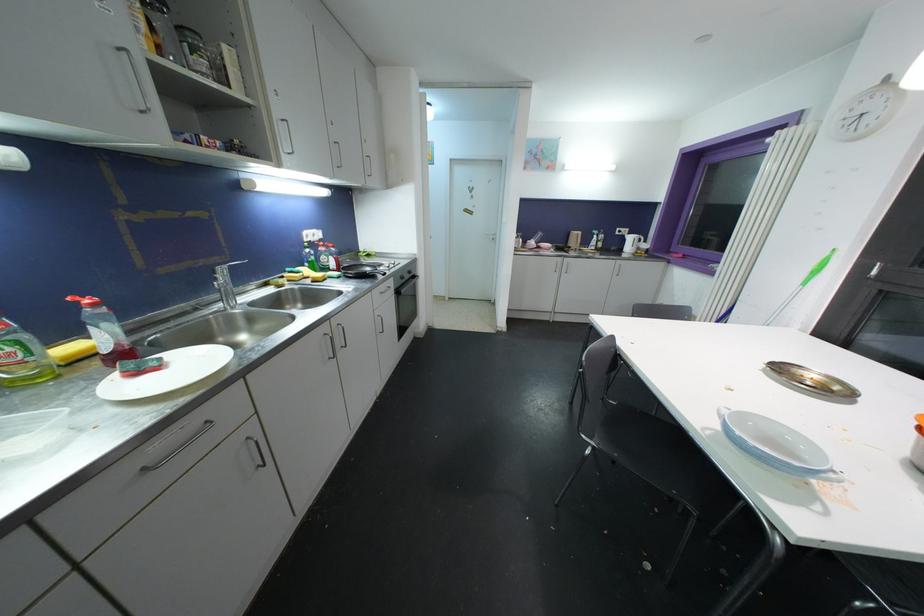
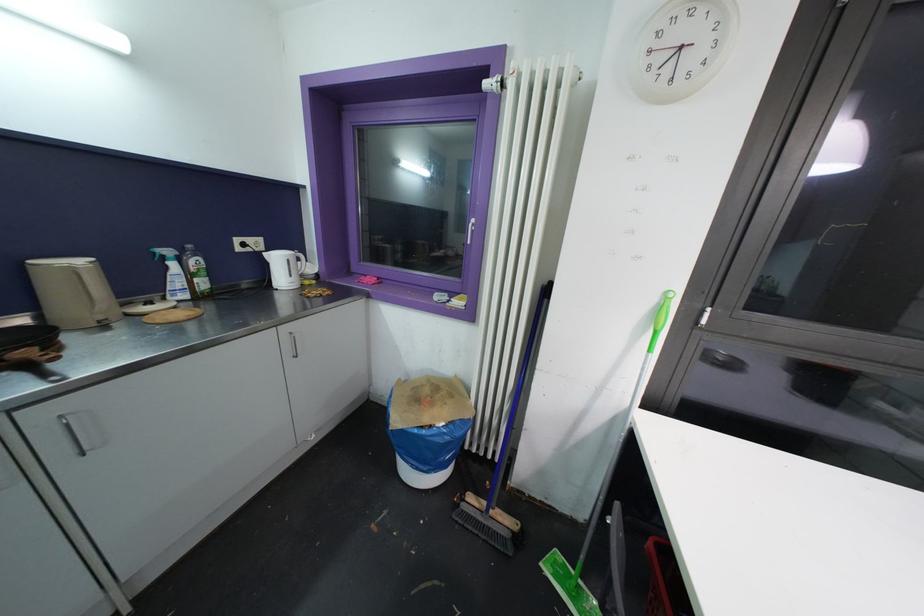
In the second image, find the point that corresponds to pixel 687 259 in the first image.

(383, 284)